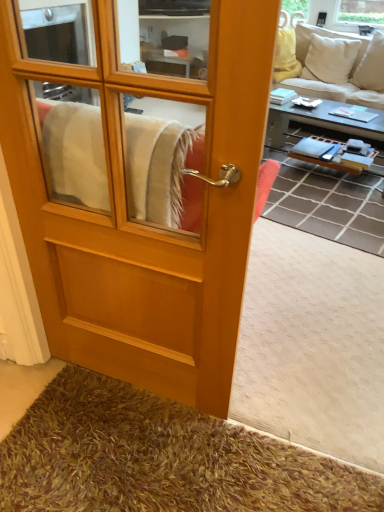
Where is `brown shaggy carpet at center`? This screenshot has width=384, height=512. brown shaggy carpet at center is located at coordinates (312, 345).

In the image, there is a wooden/textured coffee table at right. Identify the location of screen door below it (from the image's perspective). pos(142,186).

Is wooden/textured coffee table at right turned away from wooden door at center?

That's right, wooden/textured coffee table at right is facing away from wooden door at center.

Choose the correct answer: Is wooden/textured coffee table at right inside wooden door at center or outside it?

wooden/textured coffee table at right is spatially situated outside wooden door at center.

Can you confirm if wooden/textured coffee table at right is thinner than brown shaggy carpet at center?

Correct, the width of wooden/textured coffee table at right is less than that of brown shaggy carpet at center.

Can you confirm if wooden/textured coffee table at right is taller than brown shaggy carpet at center?

Indeed, wooden/textured coffee table at right has a greater height compared to brown shaggy carpet at center.

Based on the photo, would you say wooden/textured coffee table at right is to the left or to the right of brown shaggy carpet at center in the picture?

In the image, wooden/textured coffee table at right appears on the right side of brown shaggy carpet at center.

The height and width of the screenshot is (512, 384). I want to click on coffee table that is behind the brown shaggy carpet at center, so click(x=326, y=125).

From a real-world perspective, is beige fabric couch at upper right under wooden door at center?

Indeed, from a real-world perspective, beige fabric couch at upper right is positioned beneath wooden door at center.

Is beige fabric couch at upper right to the left of wooden door at center from the viewer's perspective?

Incorrect, beige fabric couch at upper right is not on the left side of wooden door at center.

Is beige fabric couch at upper right not inside wooden door at center?

Yes, beige fabric couch at upper right is outside of wooden door at center.

Are beige fabric couch at upper right and wooden door at center far apart?

Absolutely, beige fabric couch at upper right is distant from wooden door at center.

Is wooden door at center taller or shorter than beige fabric couch at upper right?

In the image, wooden door at center appears to be taller than beige fabric couch at upper right.

Is wooden door at center further to the viewer compared to beige fabric couch at upper right?

No, wooden door at center is in front of beige fabric couch at upper right.

Identify the location of studio couch below the wooden door at center (from a real-world perspective). The width and height of the screenshot is (384, 512). (339, 66).

Can you confirm if wooden door at center is smaller than beige fabric couch at upper right?

Yes, wooden door at center is smaller than beige fabric couch at upper right.

How many degrees apart are the facing directions of brown shaggy carpet at center and wooden door at center?

brown shaggy carpet at center and wooden door at center are facing 177 degrees away from each other.

Considering the points (9, 399) and (240, 219), which point is in front, point (9, 399) or point (240, 219)?

The point (240, 219) is in front.

Measure the distance between brown shaggy carpet at center and wooden door at center.

brown shaggy carpet at center is 72.25 centimeters away from wooden door at center.

Would you say brown shaggy carpet at center is outside wooden door at center?

Yes, brown shaggy carpet at center is not within wooden door at center.

In the scene shown: How distant is brown shaggy carpet at center from wooden/textured coffee table at right?

brown shaggy carpet at center is 1.47 meters from wooden/textured coffee table at right.

From a real-world perspective, is brown shaggy carpet at center on wooden/textured coffee table at right?

Incorrect, from a real-world perspective, brown shaggy carpet at center is lower than wooden/textured coffee table at right.

Which object is closer to the camera, brown shaggy carpet at center or wooden/textured coffee table at right?

brown shaggy carpet at center.

From the image's perspective, which object appears higher, brown shaggy carpet at center or wooden/textured coffee table at right?

From the image's view, wooden/textured coffee table at right is above.

Is beige fabric couch at upper right looking in the opposite direction of brown shaggy carpet at center?

beige fabric couch at upper right does not have its back to brown shaggy carpet at center.

Do you think beige fabric couch at upper right is within brown shaggy carpet at center, or outside of it?

beige fabric couch at upper right lies outside brown shaggy carpet at center.

Between point (316, 38) and point (13, 393), which one is positioned in front?

Point (13, 393)

Is beige fabric couch at upper right far away from brown shaggy carpet at center?

Yes, beige fabric couch at upper right and brown shaggy carpet at center are quite far apart.

Locate an element on the screen. screen door that appears below the wooden/textured coffee table at right (from the image's perspective) is located at coordinates (142, 186).

Where is `coffee table lying on the right of brown shaggy carpet at center`? coffee table lying on the right of brown shaggy carpet at center is located at coordinates (326, 125).

Considering their positions, is brown shaggy carpet at center positioned closer to wooden/textured coffee table at right than beige fabric couch at upper right?

Among the two, beige fabric couch at upper right is located nearer to wooden/textured coffee table at right.

Which object lies nearer to the anchor point wooden door at center, brown shaggy carpet at center or beige fabric couch at upper right?

Based on the image, brown shaggy carpet at center appears to be nearer to wooden door at center.

Estimate the real-world distances between objects in this image. Which object is further from wooden/textured coffee table at right, wooden door at center or brown shaggy carpet at center?

wooden door at center is positioned further to the anchor wooden/textured coffee table at right.

Consider the image. Considering their positions, is wooden door at center positioned further to beige fabric couch at upper right than wooden/textured coffee table at right?

wooden door at center is positioned further to the anchor beige fabric couch at upper right.

Based on their spatial positions, is beige fabric couch at upper right or wooden door at center closer to brown shaggy carpet at center?

Based on the image, wooden door at center appears to be nearer to brown shaggy carpet at center.

Based on their spatial positions, is wooden/textured coffee table at right or brown shaggy carpet at center closer to beige fabric couch at upper right?

Based on the image, wooden/textured coffee table at right appears to be nearer to beige fabric couch at upper right.

When comparing their distances from brown shaggy carpet at center, does wooden door at center or beige fabric couch at upper right seem closer?

wooden door at center is positioned closer to the anchor brown shaggy carpet at center.

Estimate the real-world distances between objects in this image. Which object is closer to wooden/textured coffee table at right, beige fabric couch at upper right or wooden door at center?

Based on the image, beige fabric couch at upper right appears to be nearer to wooden/textured coffee table at right.

Find the location of `carpets between wooden door at center and beige fabric couch at upper right in the front-back direction`. carpets between wooden door at center and beige fabric couch at upper right in the front-back direction is located at coordinates (312, 345).

Identify the location of coffee table between brown shaggy carpet at center and beige fabric couch at upper right in the front-back direction. (326, 125).

What are the coordinates of `carpets between wooden door at center and wooden/textured coffee table at right along the z-axis` in the screenshot? It's located at (312, 345).

At what (x,y) coordinates should I click in order to perform the action: click on coffee table between wooden door at center and beige fabric couch at upper right from front to back. Please return your answer as a coordinate pair (x, y). The height and width of the screenshot is (512, 384). Looking at the image, I should click on (326, 125).